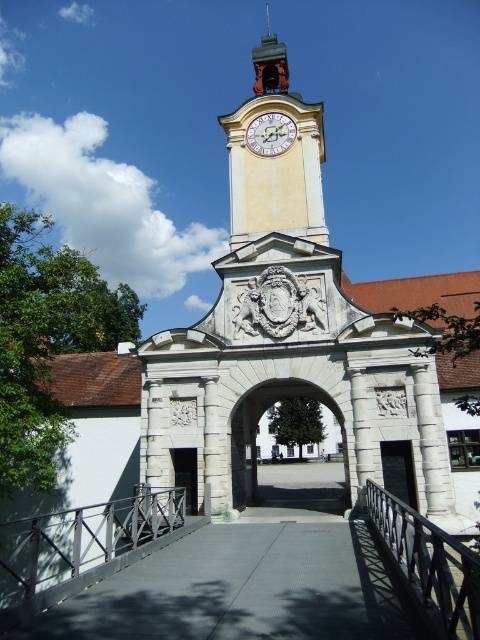
Question: Based on their relative distances, which object is nearer to the white stone archway at center?

Choices:
 (A) black wrought iron railing at lower right
 (B) black metal/rail at lower left
 (C) yellow stone clock tower at upper center

Answer: (B)

Question: Is black metal/rail at lower left further to the viewer compared to polished copper bell at upper center?

Choices:
 (A) no
 (B) yes

Answer: (A)

Question: Which object is farther from the camera taking this photo?

Choices:
 (A) polished copper bell at upper center
 (B) black metal/rail at lower left

Answer: (A)

Question: Which of the following is the farthest from the observer?

Choices:
 (A) white stone archway at center
 (B) yellow stone clock tower at center
 (C) black wrought iron railing at lower right

Answer: (A)

Question: Does black wrought iron railing at lower right have a greater width compared to polished copper bell at upper center?

Choices:
 (A) yes
 (B) no

Answer: (B)

Question: Is yellow stone clock tower at upper center wider than white painted wood clock at upper center?

Choices:
 (A) yes
 (B) no

Answer: (A)